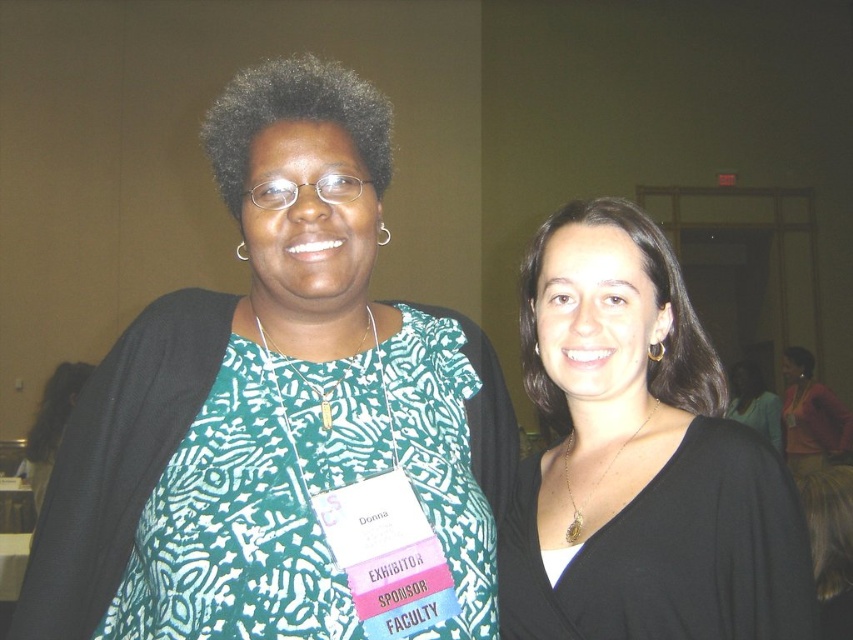
Is green printed blouse at center positioned at the back of black matte necklace at center?

That is False.

The width and height of the screenshot is (853, 640). What do you see at coordinates (281, 417) in the screenshot?
I see `green printed blouse at center` at bounding box center [281, 417].

Where is `green printed blouse at center`? The height and width of the screenshot is (640, 853). green printed blouse at center is located at coordinates (281, 417).